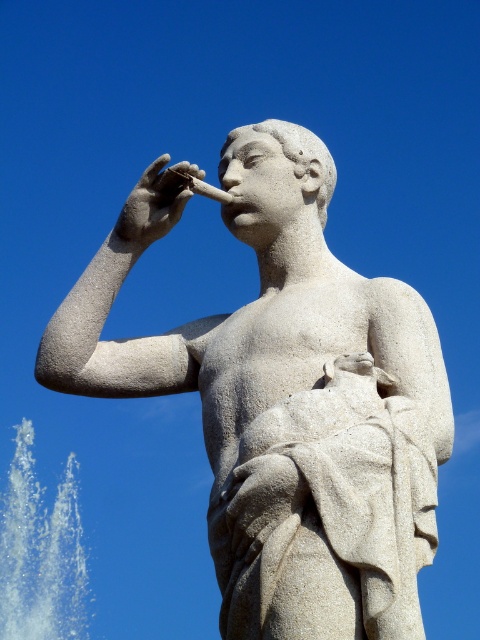
Who is positioned more to the left, white vapor at lower left or white stone hand at upper center?

Positioned to the left is white vapor at lower left.

Can you confirm if white vapor at lower left is smaller than white stone hand at upper center?

Correct, white vapor at lower left occupies less space than white stone hand at upper center.

The width and height of the screenshot is (480, 640). What are the coordinates of `white vapor at lower left` in the screenshot? It's located at (40, 552).

Locate an element on the screen. The height and width of the screenshot is (640, 480). white vapor at lower left is located at coordinates (40, 552).

The height and width of the screenshot is (640, 480). What do you see at coordinates (289, 406) in the screenshot?
I see `white stone statue at center` at bounding box center [289, 406].

Who is more forward, (344, 579) or (54, 548)?

Point (344, 579)

What are the coordinates of `white stone statue at center` in the screenshot? It's located at pyautogui.click(x=289, y=406).

Does white stone statue at center have a greater width compared to white stone hand at upper center?

Yes.

Is white stone statue at center shorter than white stone hand at upper center?

No.

What are the coordinates of `white stone statue at center` in the screenshot? It's located at (289, 406).

In order to click on white stone statue at center in this screenshot , I will do `click(289, 406)`.